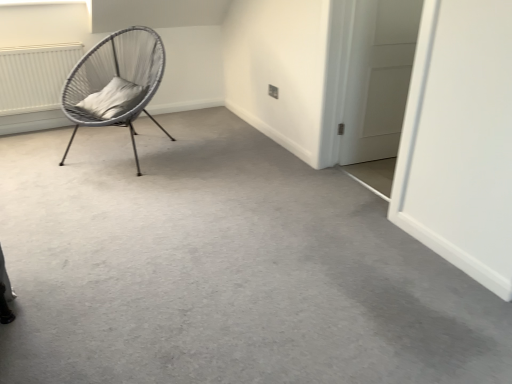
Identify the location of vacant space underneath woven grey chair at left (from a real-world perspective). (124, 147).